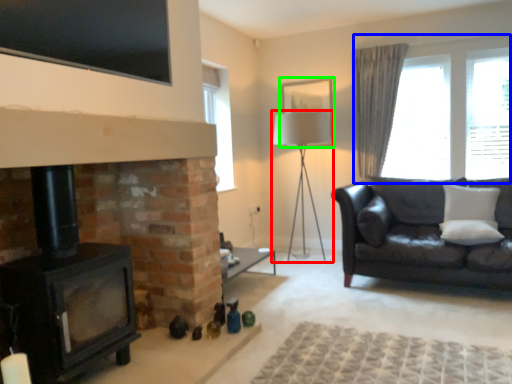
Question: Estimate the real-world distances between objects in this image. Which object is closer to table lamp (highlighted by a red box), window (highlighted by a blue box) or picture frame (highlighted by a green box)?

Choices:
 (A) window
 (B) picture frame

Answer: (B)